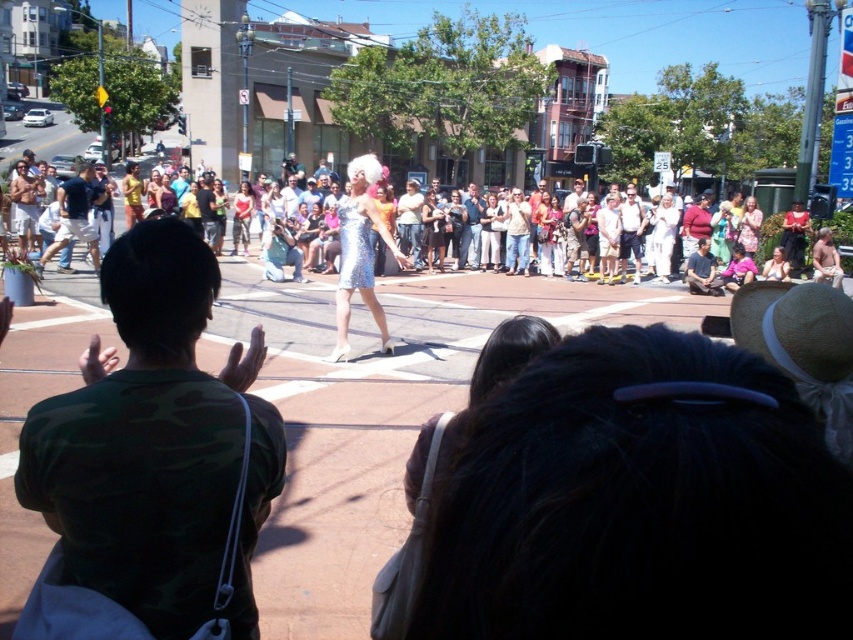
Question: Can you confirm if matte blue jeans at left is positioned above shiny silver dress at center?

Choices:
 (A) yes
 (B) no

Answer: (A)

Question: Where is matte blue jeans at left located in relation to shiny silver dress at center in the image?

Choices:
 (A) above
 (B) below

Answer: (A)

Question: Which point appears closest to the camera in this image?

Choices:
 (A) pos(59,227)
 (B) pos(839,294)
 (C) pos(238,552)

Answer: (C)

Question: Is matte blue jeans at left to the left of shiny silver dress at center from the viewer's perspective?

Choices:
 (A) no
 (B) yes

Answer: (B)

Question: Which object appears farthest from the camera in this image?

Choices:
 (A) shiny silver dress at center
 (B) matte blue jeans at left
 (C) camouflage shirt at center

Answer: (B)

Question: Which object is positioned closest to the matte blue jeans at left?

Choices:
 (A) shiny silver dress at center
 (B) camouflage shirt at center

Answer: (A)